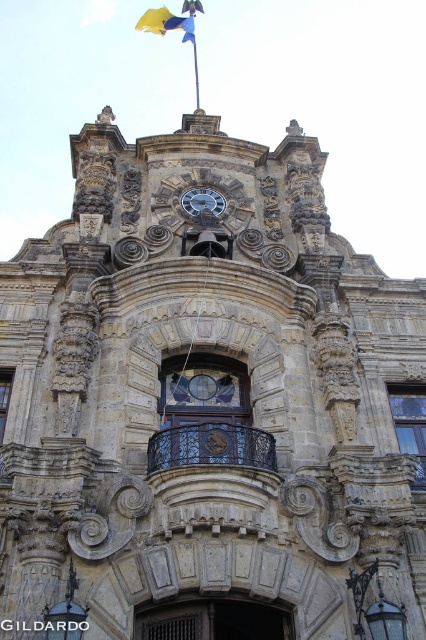
Which is below, black wrought iron balcony at center or yellow fabric flag at top?

black wrought iron balcony at center

Who is shorter, black wrought iron balcony at center or yellow fabric flag at top?

black wrought iron balcony at center

Between point (195, 436) and point (169, 13), which one is positioned behind?

The point (169, 13) is behind.

The height and width of the screenshot is (640, 426). I want to click on black wrought iron balcony at center, so click(210, 445).

Does yellow fabric flag at top come in front of silver metallic clock at center?

No, it is not.

Is yellow fabric flag at top below silver metallic clock at center?

Incorrect, yellow fabric flag at top is not positioned below silver metallic clock at center.

Measure the distance between yellow fabric flag at top and camera.

194.62 meters

Image resolution: width=426 pixels, height=640 pixels. Identify the location of yellow fabric flag at top. (166, 22).

Is point (261, 451) positioned before point (216, 196)?

Yes, point (261, 451) is closer to viewer.

Is black wrought iron balcony at center positioned before silver metallic clock at center?

Yes, black wrought iron balcony at center is in front of silver metallic clock at center.

Between point (222, 429) and point (195, 195), which one is positioned behind?

The point (195, 195) is more distant.

Where is `black wrought iron balcony at center`? This screenshot has height=640, width=426. black wrought iron balcony at center is located at coordinates (210, 445).